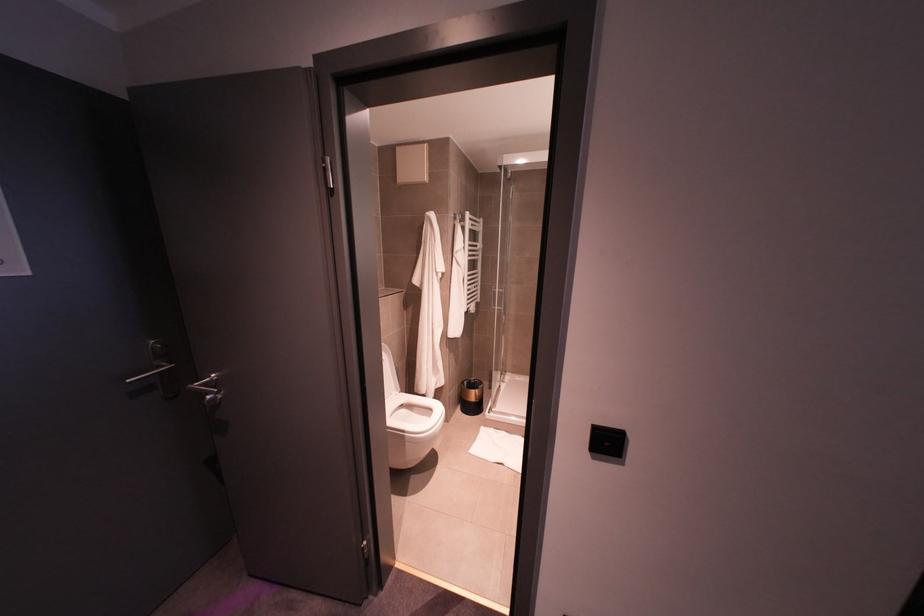
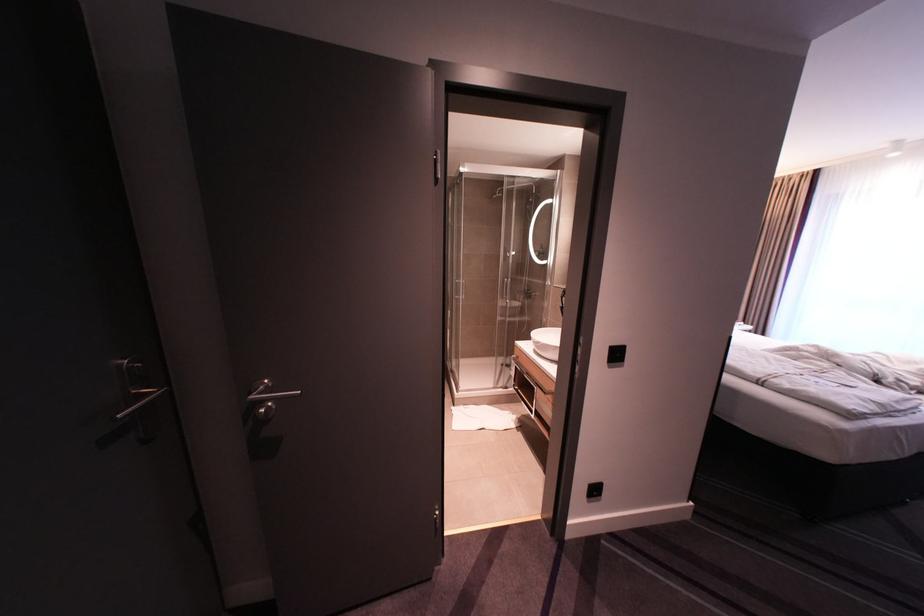
Question: The images are taken continuously from a first-person perspective. In which direction is your viewpoint rotating?

Choices:
 (A) Left
 (B) Right
 (C) Up
 (D) Down

Answer: (B)